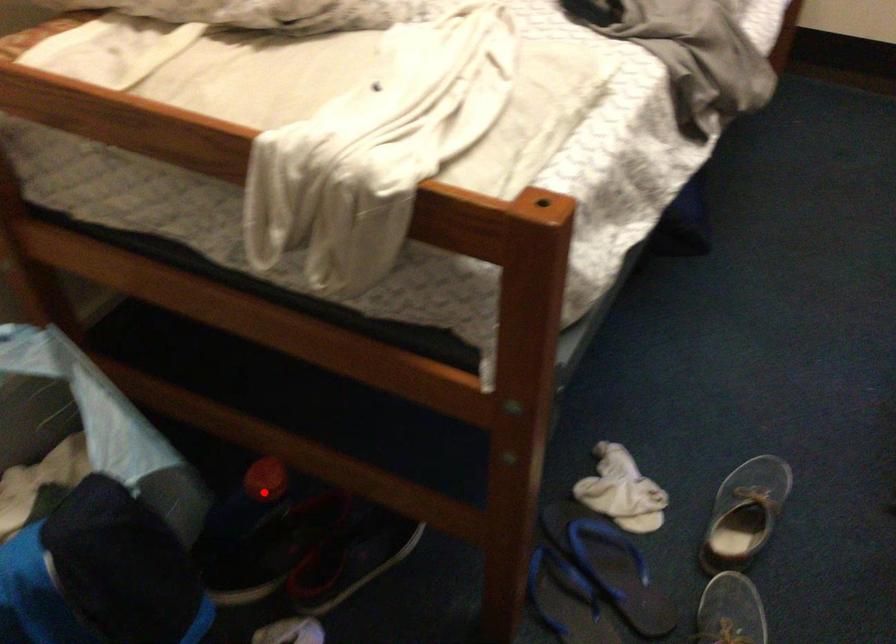
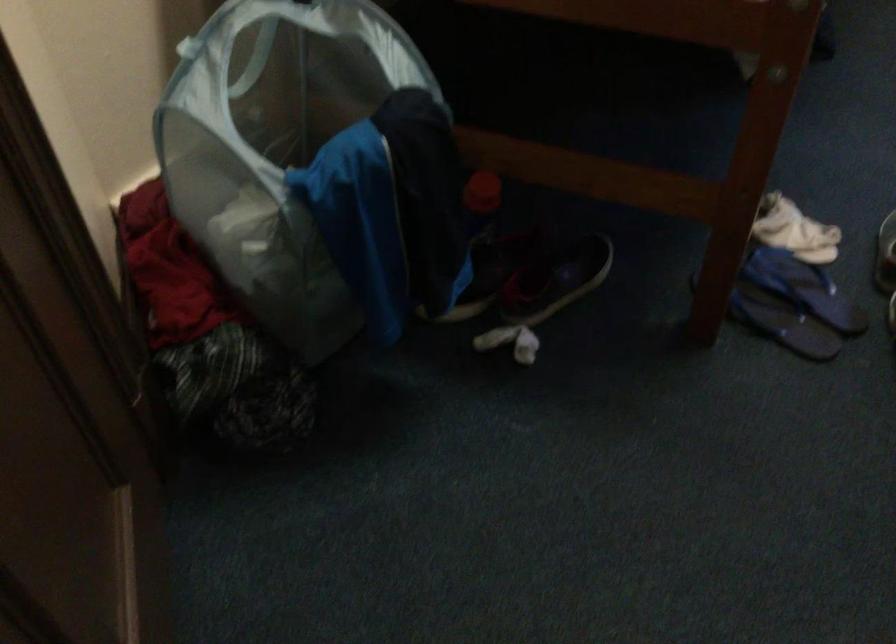
Find the pixel in the second image that matches the highlighted location in the first image.

(480, 202)